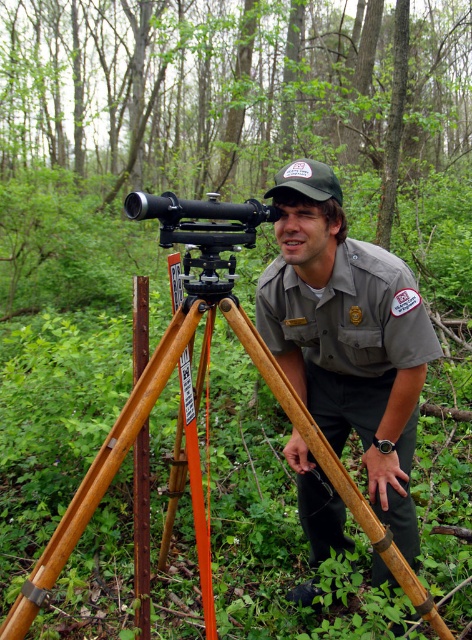
Question: Which object appears farthest from the camera in this image?

Choices:
 (A) wooden tripod at center
 (B) rusty metal pole at center
 (C) gray uniform at center

Answer: (C)

Question: Which is nearer to the metallic black telescope at center?

Choices:
 (A) rusty metal pole at center
 (B) gray uniform at center

Answer: (A)

Question: Which is nearer to the wooden tripod at center?

Choices:
 (A) metallic black telescope at center
 (B) rusty metal pole at center

Answer: (B)

Question: Can you confirm if wooden tripod at center is positioned above rusty metal pole at center?

Choices:
 (A) no
 (B) yes

Answer: (A)

Question: Does metallic black telescope at center have a lesser width compared to rusty metal pole at center?

Choices:
 (A) no
 (B) yes

Answer: (A)

Question: Considering the relative positions of wooden tripod at center and metallic black telescope at center in the image provided, where is wooden tripod at center located with respect to metallic black telescope at center?

Choices:
 (A) above
 (B) below

Answer: (B)